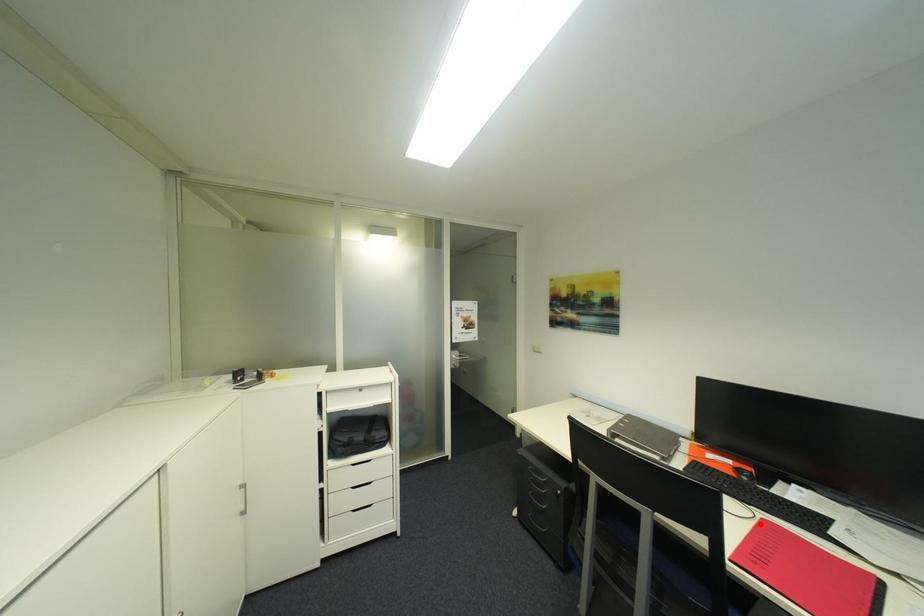
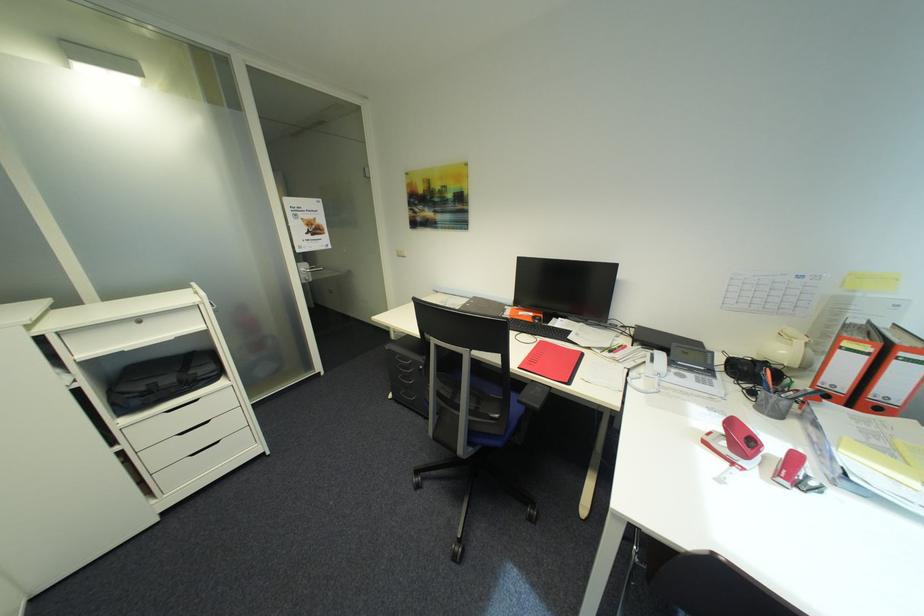
In the second image, find the point that corresponds to the highlighted location in the first image.

(542, 345)